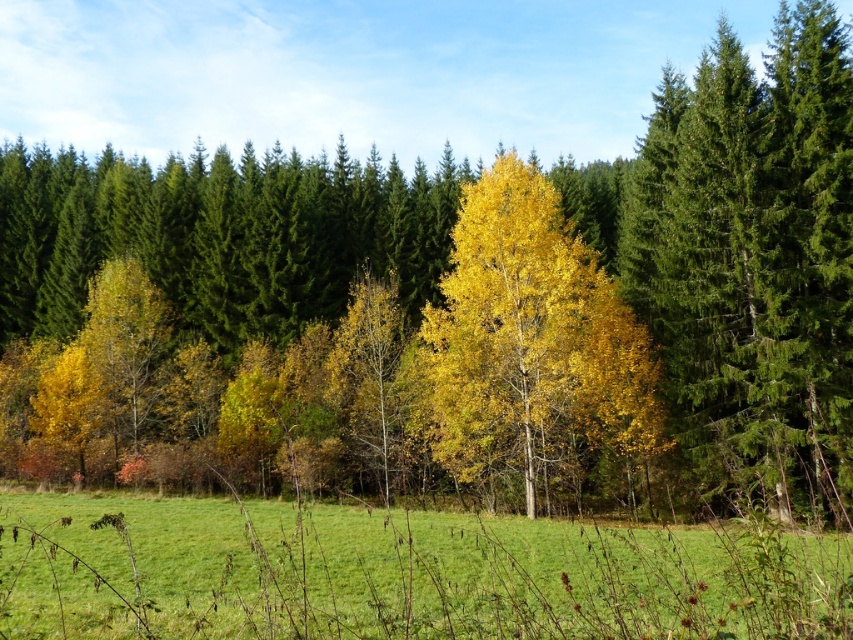
You are standing at the point marked as point (401, 573) in the image. What is the color of the ground beneath your feet?

The point (401, 573) is on green grass at center, so the ground beneath your feet is green grass.